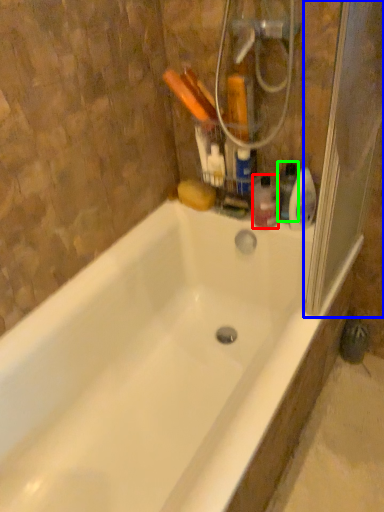
Question: Which is nearer to the toiletry (highlighted by a red box)? screen door (highlighted by a blue box) or cleaning product (highlighted by a green box).

Choices:
 (A) screen door
 (B) cleaning product

Answer: (B)